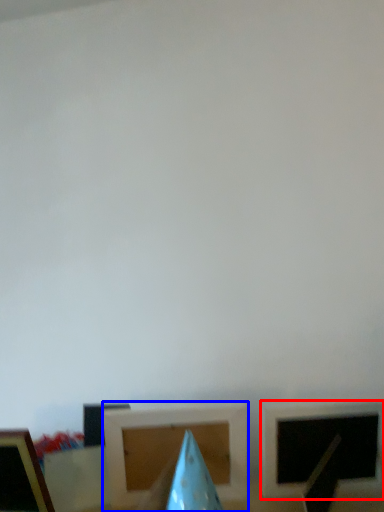
Question: Among these objects, which one is nearest to the camera, picture frame (highlighted by a red box) or picture frame (highlighted by a blue box)?

Choices:
 (A) picture frame
 (B) picture frame

Answer: (A)